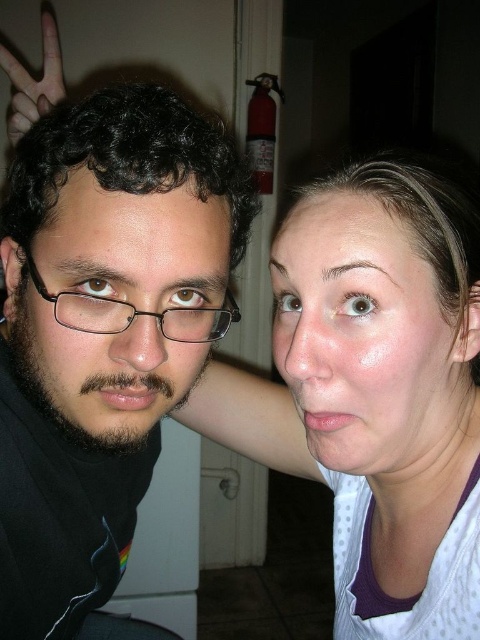
Can you confirm if matte white shirt at center is positioned above matte black face at left?

Actually, matte white shirt at center is below matte black face at left.

Does matte white shirt at center have a lesser height compared to matte black face at left?

No.

Locate an element on the screen. The width and height of the screenshot is (480, 640). matte white shirt at center is located at coordinates (374, 392).

Does point (204, 156) lie in front of point (113, 394)?

Yes, it is.

Between black matte glasses at left and matte black face at left, which one has less height?

matte black face at left

Does point (88, 353) lie in front of point (195, 355)?

Yes, point (88, 353) is in front of point (195, 355).

Where is `black matte glasses at left`? This screenshot has width=480, height=640. black matte glasses at left is located at coordinates (103, 337).

This screenshot has height=640, width=480. Describe the element at coordinates (103, 337) in the screenshot. I see `black matte glasses at left` at that location.

Does point (195, 282) lie in front of point (11, 58)?

Yes, it is in front of point (11, 58).

Does point (91, 387) come farther from viewer compared to point (29, 125)?

No.

The image size is (480, 640). In order to click on black matte glasses at left in this screenshot , I will do `click(103, 337)`.